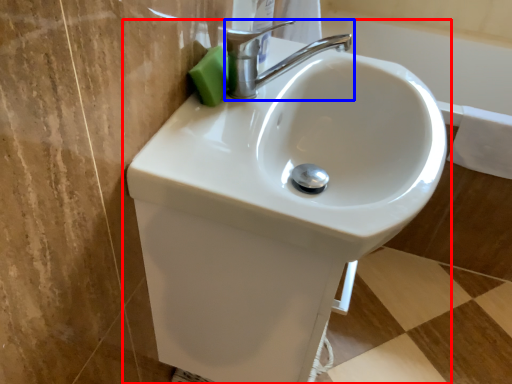
Question: Among these objects, which one is farthest to the camera, sink (highlighted by a red box) or tap (highlighted by a blue box)?

Choices:
 (A) sink
 (B) tap

Answer: (B)